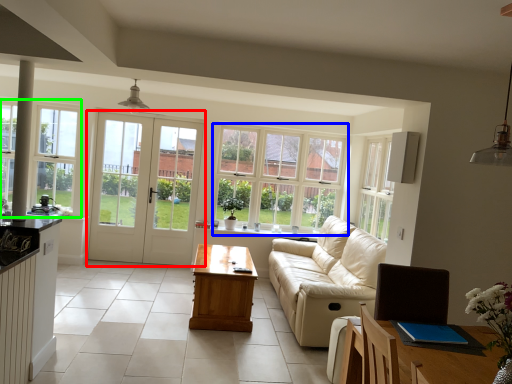
Question: Which object is the closest to the door (highlighted by a red box)? Choose among these: window (highlighted by a blue box) or window (highlighted by a green box).

Choices:
 (A) window
 (B) window

Answer: (B)